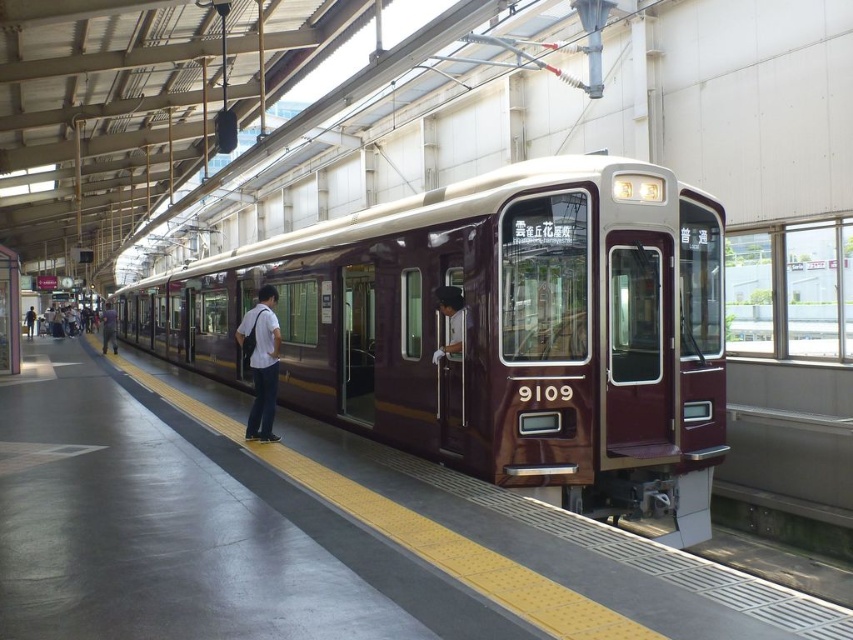
Between white shirt at center and denim jacket at center, which one appears on the right side from the viewer's perspective?

Positioned to the right is white shirt at center.

Does white shirt at center appear under denim jacket at center?

Indeed, white shirt at center is positioned under denim jacket at center.

Which is behind, point (245, 330) or point (28, 337)?

Positioned behind is point (28, 337).

You are a GUI agent. You are given a task and a screenshot of the screen. Output one action in this format:
    pyautogui.click(x=<x>, y=<y>)
    Task: Click on the white shirt at center
    
    Given the screenshot: What is the action you would take?
    pyautogui.click(x=260, y=362)

Who is taller, white shirt at center or dark purple fabric pants at center?

With more height is white shirt at center.

Identify the location of white shirt at center. Image resolution: width=853 pixels, height=640 pixels. [x=260, y=362].

This screenshot has height=640, width=853. I want to click on white shirt at center, so click(260, 362).

Which is more to the right, shiny maroon train at center or dark purple fabric pants at center?

Positioned to the right is shiny maroon train at center.

Which is above, shiny maroon train at center or dark purple fabric pants at center?

dark purple fabric pants at center is higher up.

Between point (461, 416) and point (103, 353), which one is positioned in front?

Point (461, 416)

Find the location of a particular element. This screenshot has height=640, width=853. shiny maroon train at center is located at coordinates (496, 330).